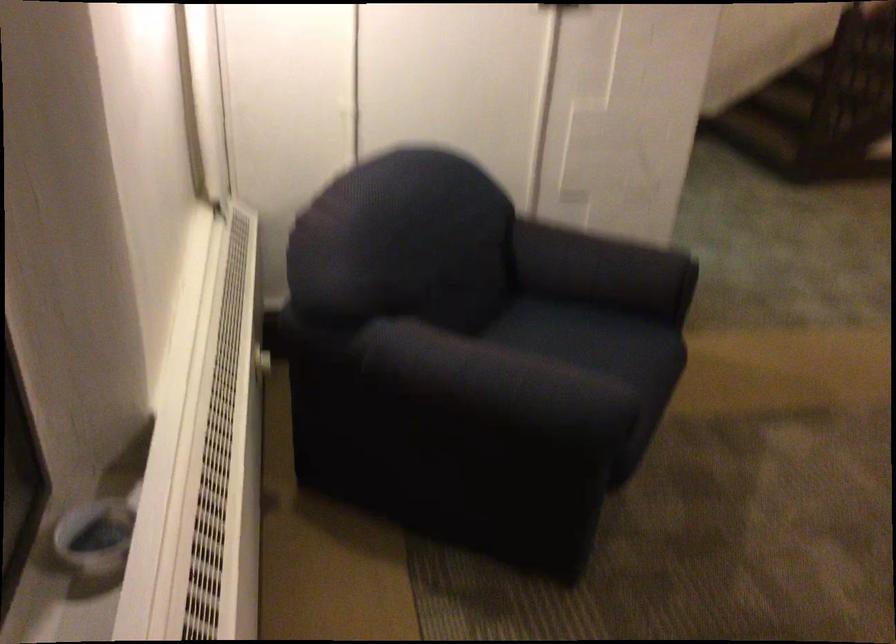
Image resolution: width=896 pixels, height=644 pixels. Identify the location of chair sitting surface. (601, 355).